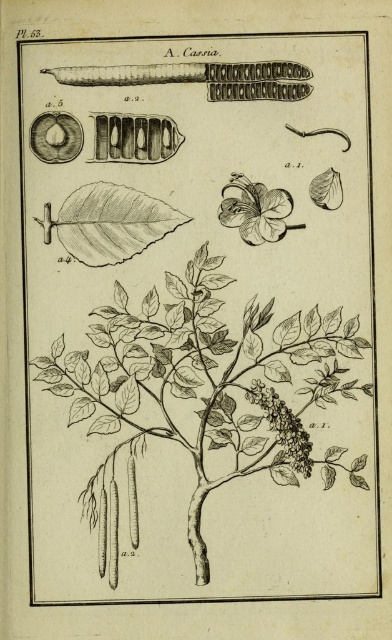
Question: Which object is closer to the camera taking this photo?

Choices:
 (A) white paper-like petals at center
 (B) black ink tree at center

Answer: (B)

Question: Is black ink tree at center positioned at the back of white paper-like petals at center?

Choices:
 (A) no
 (B) yes

Answer: (A)

Question: Which point appears farthest from the camera in this image?

Choices:
 (A) (246, 189)
 (B) (163, 339)

Answer: (B)

Question: Where is black ink tree at center located in relation to white paper-like petals at center in the image?

Choices:
 (A) right
 (B) left

Answer: (B)

Question: Can you confirm if black ink tree at center is positioned to the right of white paper-like petals at center?

Choices:
 (A) yes
 (B) no

Answer: (B)